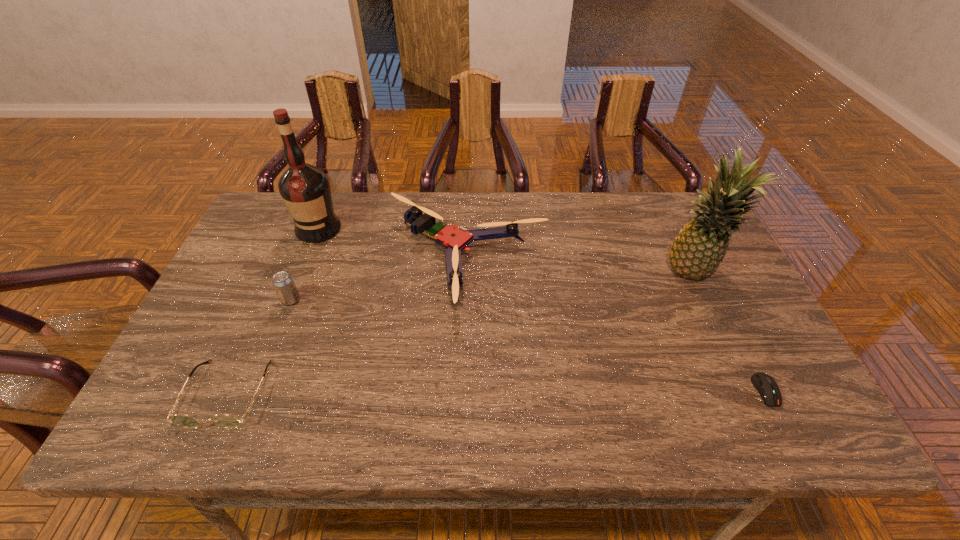
I want to click on vacant region that satisfies the following two spatial constraints: 1. on the surface of the liquor; 2. on the right side of the fourth object from left to right, so click(304, 264).